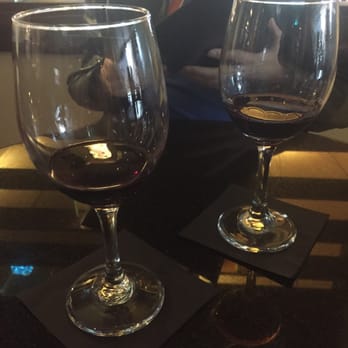
Image resolution: width=348 pixels, height=348 pixels. Find the location of `base of left wineglass`. base of left wineglass is located at coordinates (142, 304).